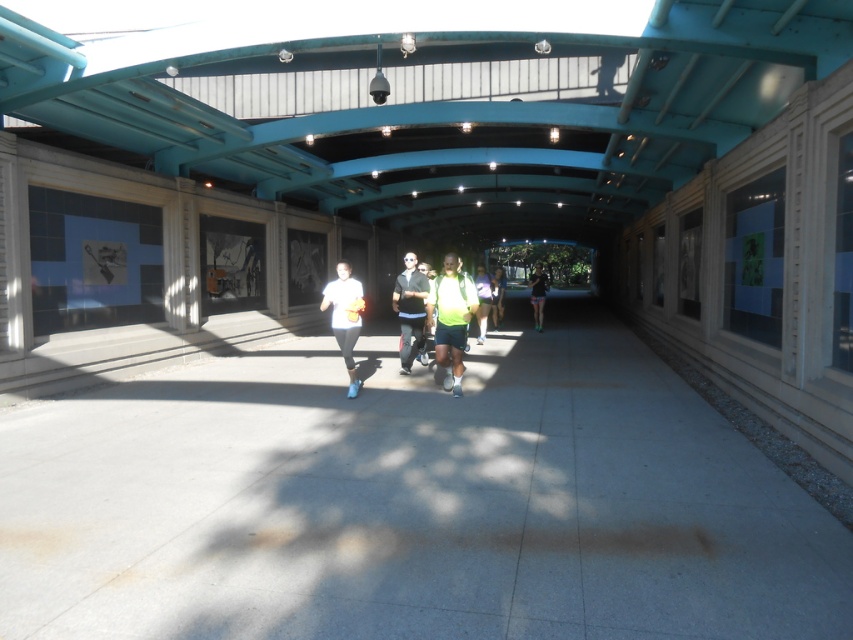
You are standing at the entrance of the covered pedestrian walkway and see two points marked on the floor. The first point is at point (456, 308) and the second point is at point (474, 280). Which point is closer to you?

Point (456, 308) is closer to the viewer than point (474, 280).

You are a photographer trying to capture a clear image of both the white matte shirt at center and the neon yellow reflective vest at center in the walkway. Given their sizes, which one might be easier to focus on and why?

The neon yellow reflective vest at center is larger since it occupies more space than the white matte shirt at center. This makes it easier to focus on the neon yellow reflective vest at center because larger objects are generally simpler to capture clearly in a photograph.

You are a pedestrian standing at the entrance of the walkway and see both the neon green fabric at center and the neon yellow reflective vest at center. Which object is larger in size?

The neon yellow reflective vest at center is larger than the neon green fabric at center.